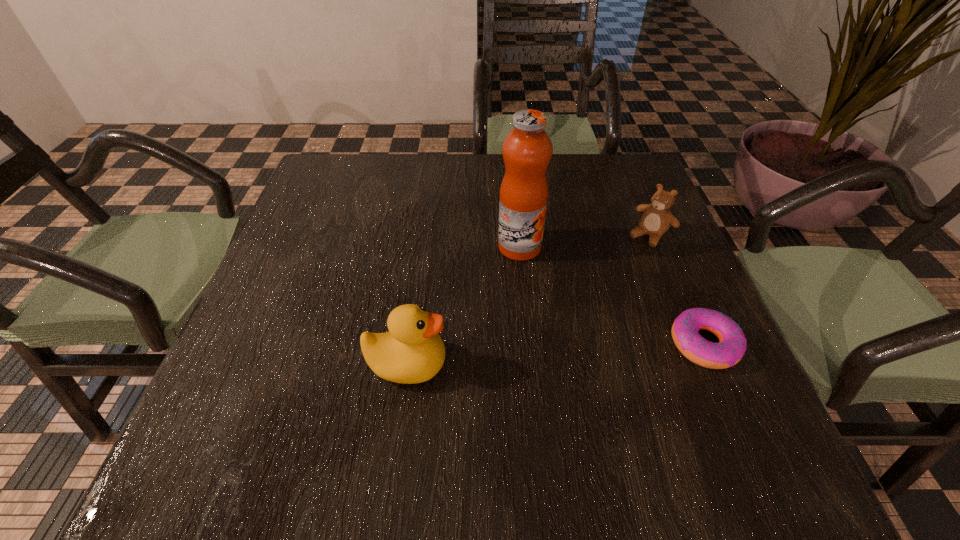
Locate an element on the screen. This screenshot has width=960, height=540. blank space at the left edge of the desktop is located at coordinates (314, 219).

Image resolution: width=960 pixels, height=540 pixels. I want to click on vacant space at the right edge of the desktop, so click(620, 216).

This screenshot has height=540, width=960. I want to click on free space at the far left corner of the desktop, so click(362, 170).

Locate an element on the screen. The width and height of the screenshot is (960, 540). vacant region at the near left corner of the desktop is located at coordinates (263, 417).

In the image, there is a desktop. Identify the location of free space at the far right corner. The image size is (960, 540). (625, 166).

Identify the location of free spot between the teddy bear and the fruit juice. (585, 241).

This screenshot has height=540, width=960. I want to click on vacant space that's between the teddy bear and the fruit juice, so click(585, 241).

Image resolution: width=960 pixels, height=540 pixels. Find the location of `empty space that is in between the tallest object and the doughnut`. empty space that is in between the tallest object and the doughnut is located at coordinates (612, 295).

Image resolution: width=960 pixels, height=540 pixels. Find the location of `free area in between the duck and the doughnut`. free area in between the duck and the doughnut is located at coordinates (556, 354).

Where is `vacant area between the teddy bear and the leftmost object`? The height and width of the screenshot is (540, 960). vacant area between the teddy bear and the leftmost object is located at coordinates (528, 300).